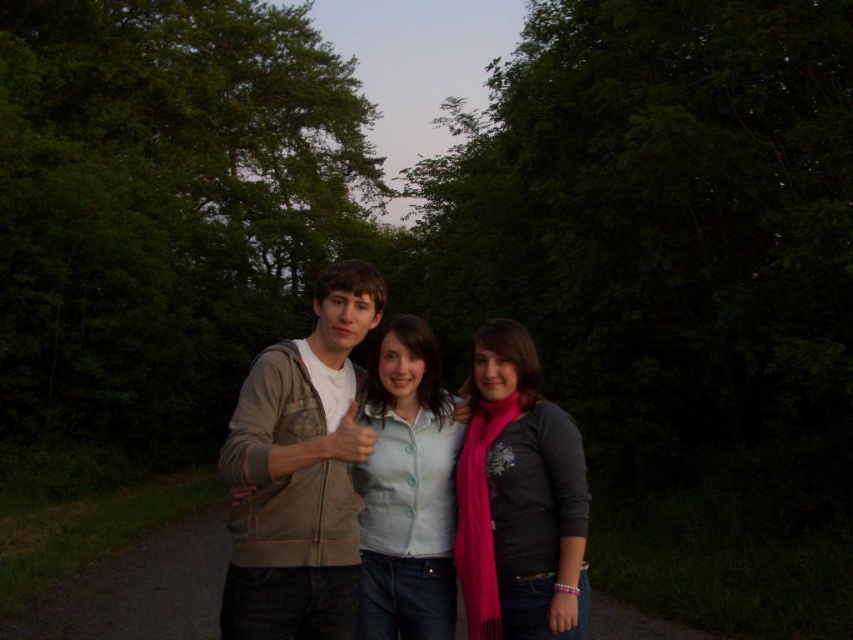
You are standing at the point with coordinates point (555, 406) and want to walk to the point with coordinates point (279, 609). Which direction should you move in to reach your destination?

You should move forward because point (279, 609) is in front of point (555, 406).

Looking at this image, you are standing on a forest path at twilight and see the matte beige hoodie at center ahead of you. If you want to take a photo of it with your phone, which has a maximum focus range of 10 feet, will you be able to capture it clearly?

The matte beige hoodie at center is 7.66 feet away from you. Since your phone can focus up to 10 feet, you can capture it clearly within the focus range.